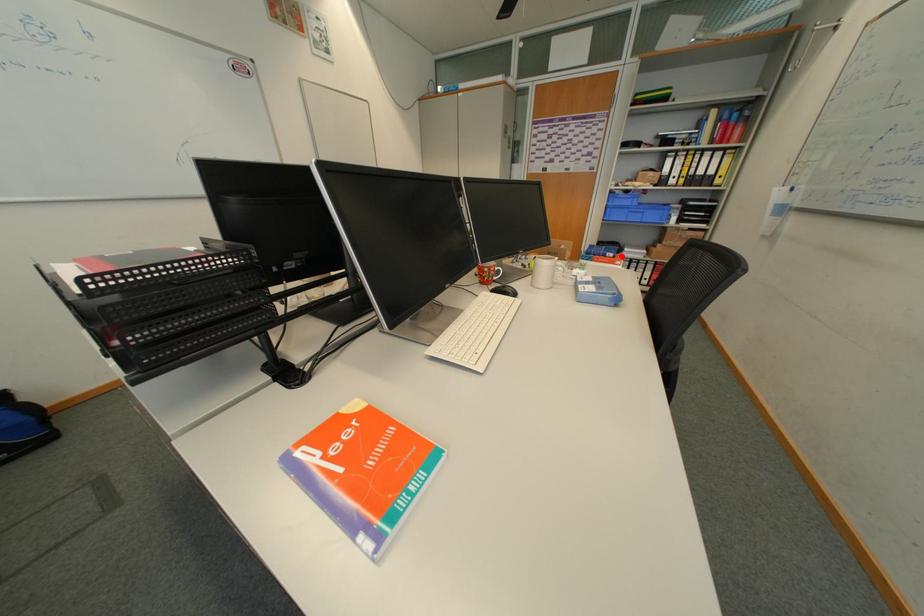
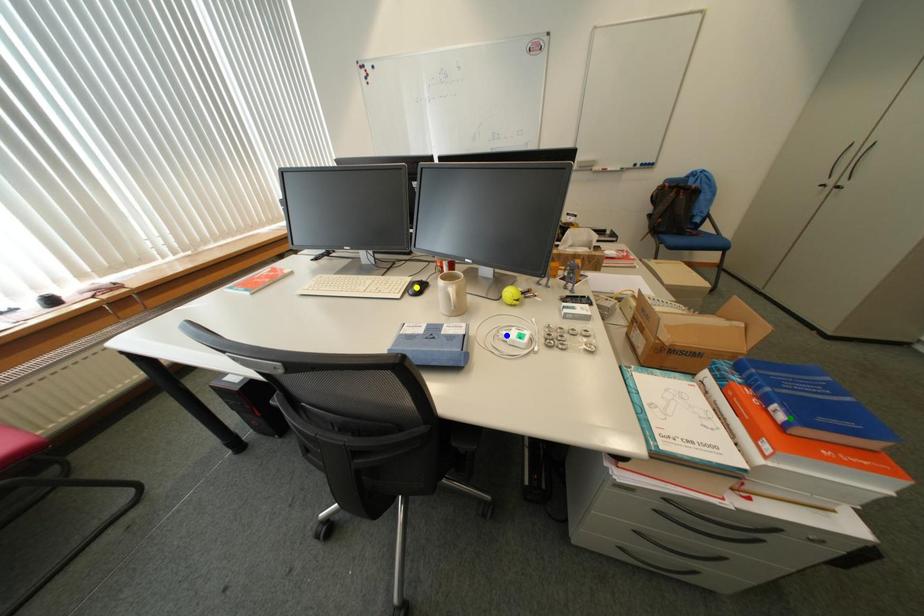
Question: I am providing you with two images of the same scene from different viewpoints. A red point is marked on the first image. You are given multiple points on the second image. Can you choose the point in image 2 that corresponds to the point in image 1?

Choices:
 (A) blue point
 (B) green point
 (C) yellow point

Answer: (B)